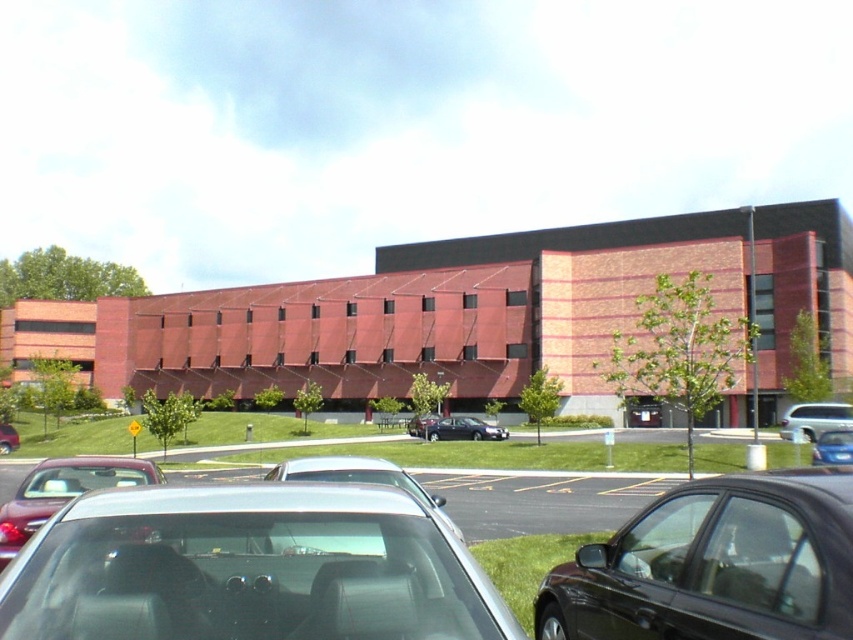
You are a parking lot attendant and need to determine which vehicle takes up more space in the parking spot. Based on the image, which vehicle is wider between the silver metallic car at center and the satin black sedan at center?

The silver metallic car at center is wider than the satin black sedan at center according to the description.

You are standing in front of the modern building and notice two points marked on its facade. The first point is at coordinate (10, 518) and the second at (341, 460). Which point is closer to you as you face the building?

Point (10, 518) is closer to you because it is in front of point (341, 460) when facing the building.

You are a pedestrian standing in front of the modern building. You see a black glossy car at lower right and a matte silver sedan at lower left. Which car is closer to you?

The black glossy car at lower right is closer to you because it is in front of the matte silver sedan at lower left.